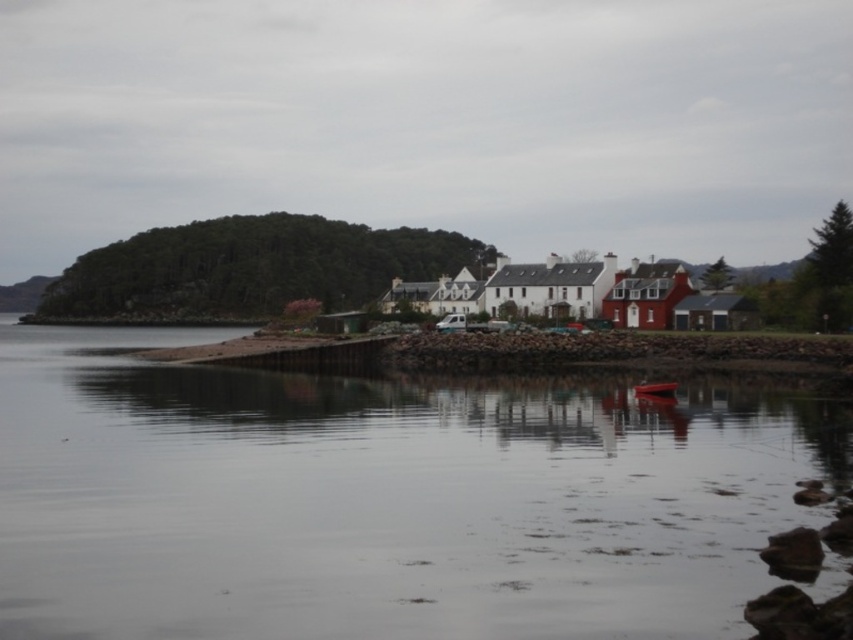
Question: Is smooth water at center below green forested island at left?

Choices:
 (A) no
 (B) yes

Answer: (B)

Question: Is smooth water at center further to camera compared to metallic red boat at center?

Choices:
 (A) no
 (B) yes

Answer: (A)

Question: Which object is positioned closest to the smooth water at center?

Choices:
 (A) metallic red boat at center
 (B) green forested island at left

Answer: (A)

Question: Estimate the real-world distances between objects in this image. Which object is farther from the smooth water at center?

Choices:
 (A) green forested island at left
 (B) metallic red boat at center

Answer: (A)

Question: Which point is farther to the camera?

Choices:
 (A) green forested island at left
 (B) metallic red boat at center

Answer: (A)

Question: Does smooth water at center lie behind metallic red boat at center?

Choices:
 (A) yes
 (B) no

Answer: (B)